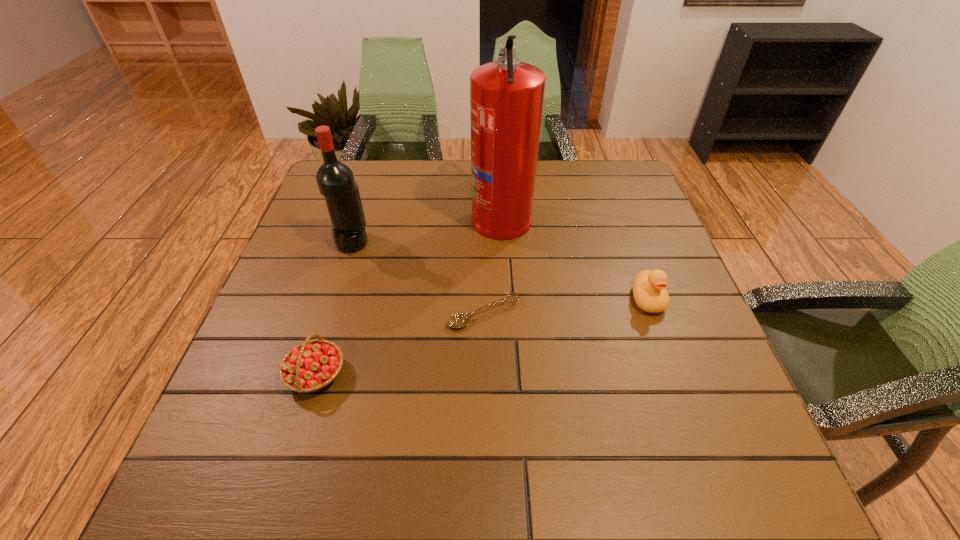
Identify the location of the tallest object. Image resolution: width=960 pixels, height=540 pixels. (506, 96).

Image resolution: width=960 pixels, height=540 pixels. Find the location of `the second tallest object`. the second tallest object is located at coordinates (335, 180).

Locate an element on the screen. This screenshot has height=540, width=960. the rightmost object is located at coordinates (649, 287).

Identify the location of the nearest object. (311, 366).

You are a GUI agent. You are given a task and a screenshot of the screen. Output one action in this format:
    pyautogui.click(x=<x>, y=<y>)
    Task: Click on the ladle
    Image resolution: width=960 pixels, height=540 pixels.
    Given the screenshot: What is the action you would take?
    pyautogui.click(x=459, y=320)

Locate an element on the screen. vacant space situated 0.310m on the instruction side of the fire extinguisher is located at coordinates (x=357, y=218).

You are a GUI agent. You are given a task and a screenshot of the screen. Output one action in this format:
    pyautogui.click(x=<x>, y=<y>)
    Task: Click on the free location located 0.080m on the instruction side of the fire extinguisher
    The height and width of the screenshot is (540, 960).
    Given the screenshot: What is the action you would take?
    pyautogui.click(x=442, y=218)

Image resolution: width=960 pixels, height=540 pixels. In order to click on vacant space situated on the instruction side of the fire extinguisher in this screenshot , I will do `click(343, 218)`.

Find the location of a particular element. The image size is (960, 540). vacant space located on the front of the wine bottle is located at coordinates (342, 276).

Where is `vacant space located on the face of the rightmost object`? This screenshot has height=540, width=960. vacant space located on the face of the rightmost object is located at coordinates (695, 432).